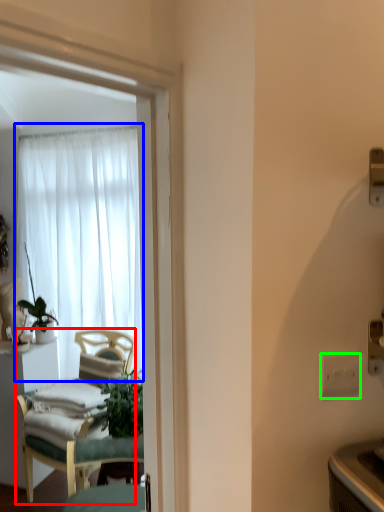
Question: Which object is the closest to the chair (highlighted by a red box)? Choose among these: curtain (highlighted by a blue box) or electric outlet (highlighted by a green box).

Choices:
 (A) curtain
 (B) electric outlet

Answer: (A)